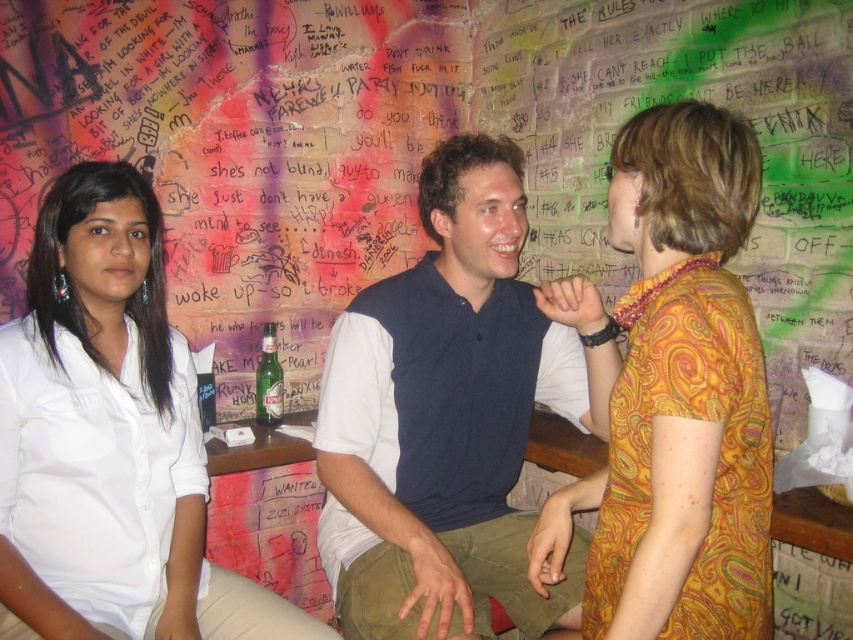
Question: Which point is farther to the camera?

Choices:
 (A) (189, 376)
 (B) (260, 365)
 (C) (625, 440)
 (D) (593, 332)

Answer: (B)

Question: Is dark blue shirt at center below white smooth shirt at left?

Choices:
 (A) yes
 (B) no

Answer: (B)

Question: Does yellow paisley dress at center have a greater width compared to green glass beer bottle at center?

Choices:
 (A) yes
 (B) no

Answer: (A)

Question: Which point is closer to the camera?

Choices:
 (A) (683, 627)
 (B) (392, 563)

Answer: (A)

Question: Is dark blue shirt at center closer to the viewer compared to green glass beer bottle at center?

Choices:
 (A) yes
 (B) no

Answer: (A)

Question: Which point appears farthest from the camera in this image?

Choices:
 (A) (16, 454)
 (B) (589, 486)
 (C) (270, 385)
 (D) (506, 152)

Answer: (C)